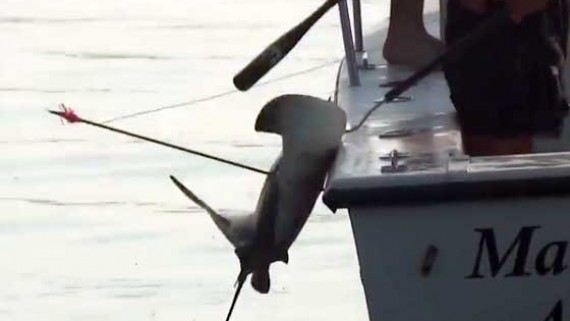
Find the location of a particular element. The image size is (570, 321). handle of hook is located at coordinates (503, 21).